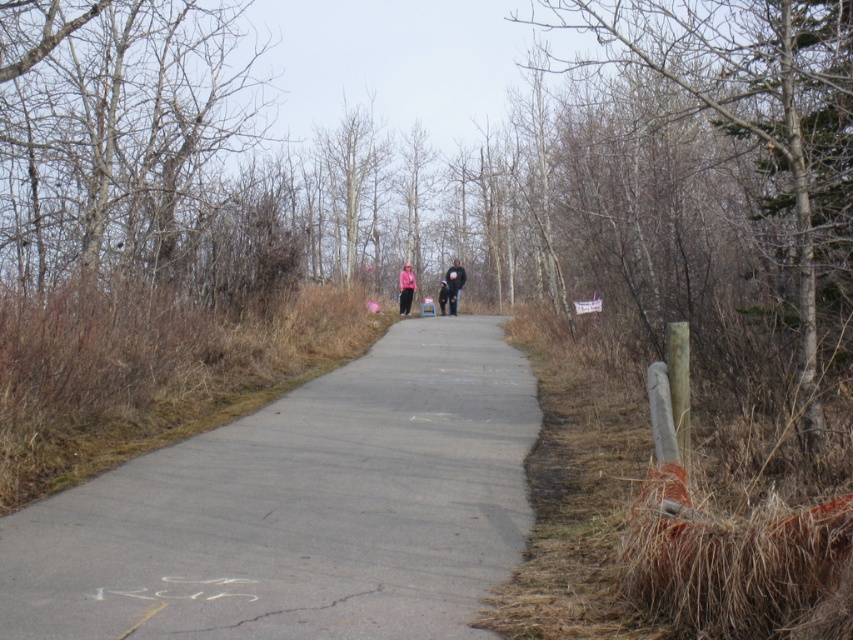
In the scene shown: You are standing at the starting point of the pathway and see the point marked at coordinates (x=753, y=100). What object is located at that point?

The point at coordinates (x=753, y=100) corresponds to a smooth bark tree at right.

You are a hiker carrying a backpack that has a 15 meter rope. You need to secure your gear to a tree that is the smooth bark tree at right. You are currently standing at the position of the black matte jacket at center. Do you have enough rope to reach the tree without moving from your current spot?

The distance between the smooth bark tree at right and the black matte jacket at center is 13.03 meters. Since your rope is 15 meters long, which is longer than the distance, you have enough rope to reach the tree without moving.

Based on the photo, you are a hiker planning to walk along the pathway in the scene. You notice the smooth bark tree at right and the pink fabric at center. Which object would block your view more if you were standing at the starting point of the pathway?

The smooth bark tree at right is larger in size than the pink fabric at center, so it would block your view more from the starting point of the pathway.